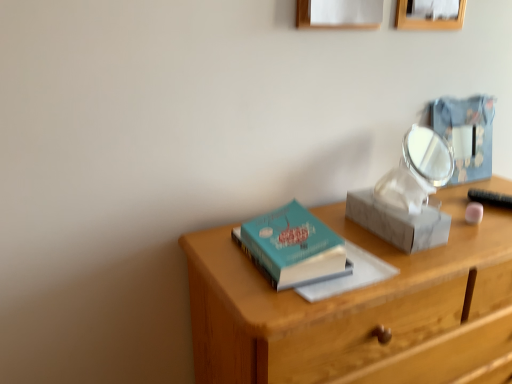
Question: Considering the relative sizes of metallic blue box at upper right and white paper at upper center, marked as the first picture frame in a left-to-right arrangement, in the image provided, is metallic blue box at upper right bigger than white paper at upper center, marked as the first picture frame in a left-to-right arrangement,?

Choices:
 (A) yes
 (B) no

Answer: (B)

Question: Considering the relative positions of metallic blue box at upper right and white paper at upper center, marked as the first picture frame in a left-to-right arrangement, in the image provided, is metallic blue box at upper right in front of white paper at upper center, marked as the first picture frame in a left-to-right arrangement,?

Choices:
 (A) no
 (B) yes

Answer: (A)

Question: Is metallic blue box at upper right thinner than white paper at upper center, which is the second picture frame in right-to-left order?

Choices:
 (A) yes
 (B) no

Answer: (B)

Question: Is metallic blue box at upper right facing away from white paper at upper center, marked as the first picture frame in a left-to-right arrangement?

Choices:
 (A) yes
 (B) no

Answer: (B)

Question: From a real-world perspective, is metallic blue box at upper right over white paper at upper center, marked as the first picture frame in a left-to-right arrangement?

Choices:
 (A) yes
 (B) no

Answer: (B)

Question: Is white marble shoe box at center-right in front of or behind teal matte hardcover book at center in the image?

Choices:
 (A) front
 (B) behind

Answer: (B)

Question: From the image's perspective, relative to teal matte hardcover book at center, is white marble shoe box at center-right above or below?

Choices:
 (A) above
 (B) below

Answer: (A)

Question: Based on their positions, is white marble shoe box at center-right located to the left or right of teal matte hardcover book at center?

Choices:
 (A) right
 (B) left

Answer: (A)

Question: From a real-world perspective, relative to teal matte hardcover book at center, is white marble shoe box at center-right vertically above or below?

Choices:
 (A) below
 (B) above

Answer: (B)

Question: Is wooden desk at center inside the boundaries of metallic blue box at upper right, or outside?

Choices:
 (A) inside
 (B) outside

Answer: (B)

Question: From the image's perspective, is wooden desk at center positioned above or below metallic blue box at upper right?

Choices:
 (A) below
 (B) above

Answer: (A)

Question: Looking at their shapes, would you say wooden desk at center is wider or thinner than metallic blue box at upper right?

Choices:
 (A) wide
 (B) thin

Answer: (A)

Question: From a real-world perspective, relative to metallic blue box at upper right, is wooden desk at center vertically above or below?

Choices:
 (A) below
 (B) above

Answer: (A)

Question: Relative to wooden picture frame at upper center, marked as the first picture frame in a right-to-left arrangement, is wooden desk at center in front or behind?

Choices:
 (A) behind
 (B) front

Answer: (B)

Question: Is wooden desk at center bigger or smaller than wooden picture frame at upper center, marked as the first picture frame in a right-to-left arrangement?

Choices:
 (A) big
 (B) small

Answer: (A)